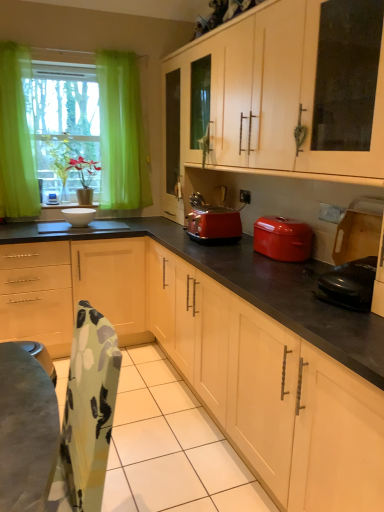
At what (x,y) coordinates should I click in order to perform the action: click on vacant space underneath white glossy bowl at center, the first appliance when ordered from top to bottom (from a real-world perspective). Please return your answer as a coordinate pair (x, y). Looking at the image, I should click on (87, 222).